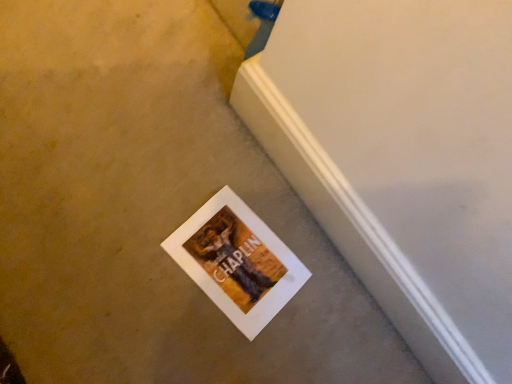
The image size is (512, 384). I want to click on vacant location below white matte picture frame at lower center (from a real-world perspective), so click(x=223, y=271).